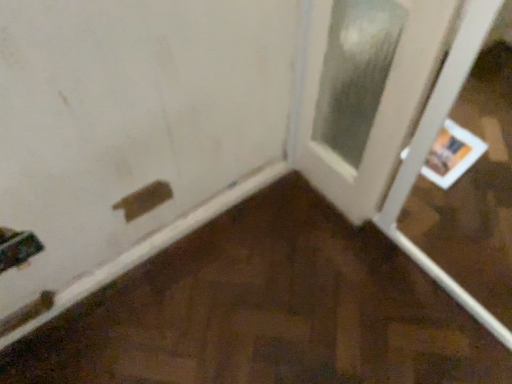
Question: Is matte white door at lower left, which is counted as the second door, starting from the right, smaller than brown matte plywood at lower left?

Choices:
 (A) yes
 (B) no

Answer: (A)

Question: From a real-world perspective, is matte white door at lower left, which is counted as the second door, starting from the right, on top of brown matte plywood at lower left?

Choices:
 (A) yes
 (B) no

Answer: (A)

Question: Can you confirm if matte white door at lower left, which is counted as the second door, starting from the right, is shorter than brown matte plywood at lower left?

Choices:
 (A) no
 (B) yes

Answer: (A)

Question: Is matte white door at lower left, arranged as the first door when viewed from the left, touching brown matte plywood at lower left?

Choices:
 (A) yes
 (B) no

Answer: (B)

Question: From a real-world perspective, is matte white door at lower left, which is counted as the second door, starting from the right, positioned under brown matte plywood at lower left based on gravity?

Choices:
 (A) no
 (B) yes

Answer: (A)

Question: In the image, is brown matte plywood at lower left on the left side or the right side of white glossy door at right, which is counted as the 2th door, starting from the left?

Choices:
 (A) left
 (B) right

Answer: (A)

Question: Is brown matte plywood at lower left taller or shorter than white glossy door at right, which is counted as the 2th door, starting from the left?

Choices:
 (A) tall
 (B) short

Answer: (A)

Question: From a real-world perspective, is brown matte plywood at lower left positioned above or below white glossy door at right, which is counted as the 2th door, starting from the left?

Choices:
 (A) below
 (B) above

Answer: (B)

Question: From the image's perspective, is brown matte plywood at lower left located above or below white glossy door at right, which is counted as the 2th door, starting from the left?

Choices:
 (A) above
 (B) below

Answer: (B)

Question: Relative to white glossy door at right, which is counted as the 2th door, starting from the left, is matte white door at lower left, arranged as the first door when viewed from the left, in front or behind?

Choices:
 (A) front
 (B) behind

Answer: (A)

Question: From the image's perspective, relative to white glossy door at right, which is the first door from right to left, is matte white door at lower left, arranged as the first door when viewed from the left, above or below?

Choices:
 (A) below
 (B) above

Answer: (A)

Question: From their relative heights in the image, would you say matte white door at lower left, which is counted as the second door, starting from the right, is taller or shorter than white glossy door at right, which is counted as the 2th door, starting from the left?

Choices:
 (A) tall
 (B) short

Answer: (A)

Question: In terms of size, does matte white door at lower left, which is counted as the second door, starting from the right, appear bigger or smaller than white glossy door at right, which is counted as the 2th door, starting from the left?

Choices:
 (A) big
 (B) small

Answer: (B)

Question: Is point (397, 132) closer or farther from the camera than point (307, 223)?

Choices:
 (A) farther
 (B) closer

Answer: (B)

Question: Do you think white glossy door at right, which is counted as the 2th door, starting from the left, is within brown matte plywood at lower left, or outside of it?

Choices:
 (A) inside
 (B) outside

Answer: (B)